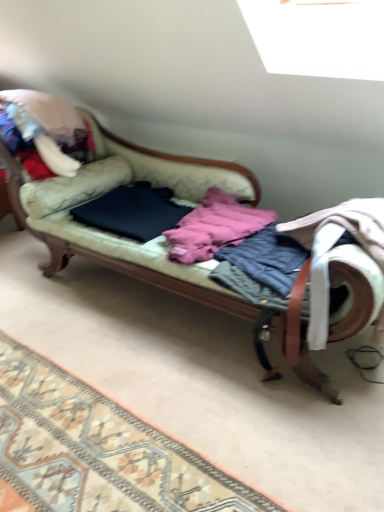
Question: Is dark blue fabric at center, the third clothing when ordered from right to left, a part of patterned carpet at lower left?

Choices:
 (A) no
 (B) yes

Answer: (A)

Question: Is patterned carpet at lower left not within dark blue fabric at center, the third clothing when ordered from right to left?

Choices:
 (A) no
 (B) yes

Answer: (B)

Question: Is dark blue fabric at center, the third clothing when ordered from right to left, at the back of patterned carpet at lower left?

Choices:
 (A) yes
 (B) no

Answer: (B)

Question: Considering the relative sizes of patterned carpet at lower left and dark blue fabric at center, positioned as the first clothing in left-to-right order, in the image provided, is patterned carpet at lower left smaller than dark blue fabric at center, positioned as the first clothing in left-to-right order,?

Choices:
 (A) no
 (B) yes

Answer: (B)

Question: From a real-world perspective, is patterned carpet at lower left physically below dark blue fabric at center, the third clothing when ordered from right to left?

Choices:
 (A) yes
 (B) no

Answer: (A)

Question: Considering the positions of point (198, 222) and point (61, 266), is point (198, 222) closer or farther from the camera than point (61, 266)?

Choices:
 (A) farther
 (B) closer

Answer: (B)

Question: In the image, is pink fleece jacket at center, the 2th clothing positioned from the left, positioned in front of or behind velvet green couch at center?

Choices:
 (A) behind
 (B) front

Answer: (A)

Question: In the image, is pink fleece jacket at center, the 2th clothing positioned from the left, on the left side or the right side of velvet green couch at center?

Choices:
 (A) left
 (B) right

Answer: (B)

Question: Do you think pink fleece jacket at center, the 2th clothing positioned from the left, is within velvet green couch at center, or outside of it?

Choices:
 (A) outside
 (B) inside

Answer: (B)

Question: Considering the positions of point (31, 432) and point (188, 218), is point (31, 432) closer or farther from the camera than point (188, 218)?

Choices:
 (A) farther
 (B) closer

Answer: (B)

Question: In terms of size, does patterned carpet at lower left appear bigger or smaller than pink fleece jacket at center, marked as the second clothing in a right-to-left arrangement?

Choices:
 (A) big
 (B) small

Answer: (B)

Question: From their relative heights in the image, would you say patterned carpet at lower left is taller or shorter than pink fleece jacket at center, marked as the second clothing in a right-to-left arrangement?

Choices:
 (A) tall
 (B) short

Answer: (B)

Question: In the image, is patterned carpet at lower left positioned in front of or behind pink fleece jacket at center, the 2th clothing positioned from the left?

Choices:
 (A) front
 (B) behind

Answer: (A)

Question: From the image's perspective, relative to velvet green couch at center, is patterned carpet at lower left above or below?

Choices:
 (A) above
 (B) below

Answer: (B)

Question: In terms of size, does patterned carpet at lower left appear bigger or smaller than velvet green couch at center?

Choices:
 (A) big
 (B) small

Answer: (B)